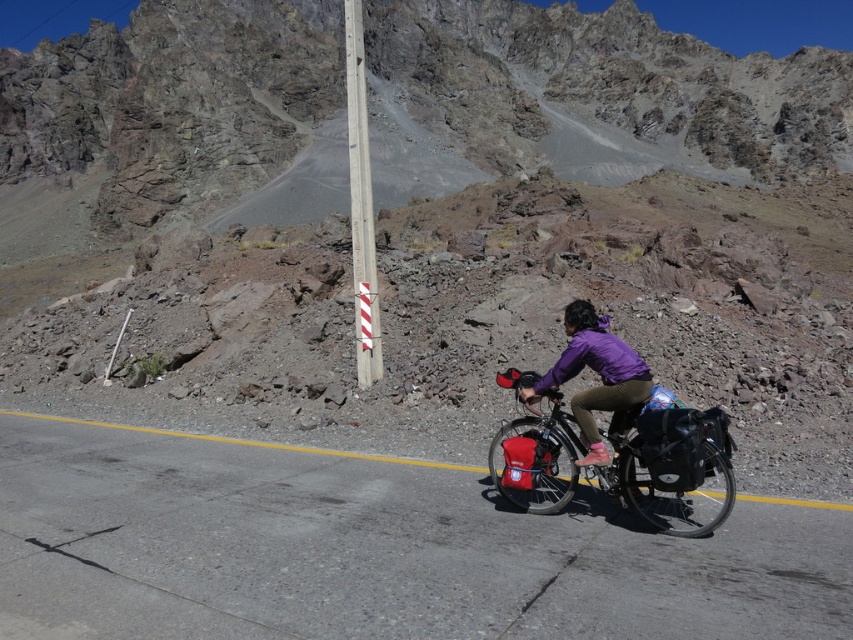
Which is below, gray asphalt road at center or purple matte jacket at center?

gray asphalt road at center is lower down.

In the scene shown: Which is above, gray asphalt road at center or purple matte jacket at center?

purple matte jacket at center is higher up.

Is point (83, 540) closer to camera compared to point (572, 342)?

Yes, it is.

The width and height of the screenshot is (853, 640). Find the location of `gray asphalt road at center`. gray asphalt road at center is located at coordinates 374,550.

Is gray asphalt road at center shorter than matte black bicycle at center?

Yes, gray asphalt road at center is shorter than matte black bicycle at center.

Image resolution: width=853 pixels, height=640 pixels. Identify the location of gray asphalt road at center. (374, 550).

Which is above, matte black bicycle at center or purple matte jacket at center?

purple matte jacket at center is above.

Looking at this image, measure the distance between matte black bicycle at center and camera.

matte black bicycle at center is 11.08 meters away from camera.

Does point (657, 433) lie behind point (614, 369)?

No.

Where is `matte black bicycle at center`? matte black bicycle at center is located at coordinates (669, 465).